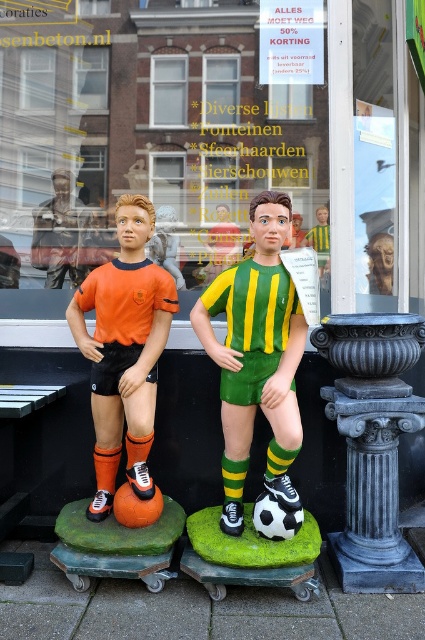
You are a customer looking at the storefront display. You see the matte plastic figurines at center and the orange matte soccer player at left. Which one is positioned higher up?

The matte plastic figurines at center are positioned higher up than the orange matte soccer player at left.

What is the location of the point with coordinates (257, 356) in the image?

The point with coordinates (257, 356) is located on the green and yellow striped jersey at center.